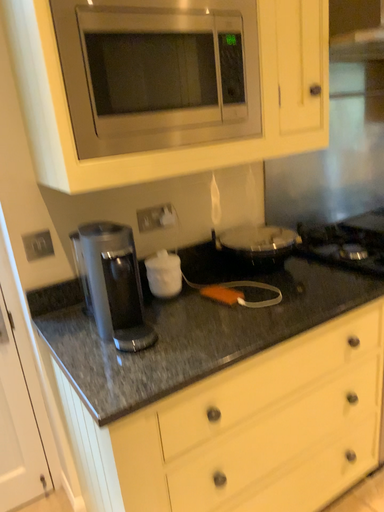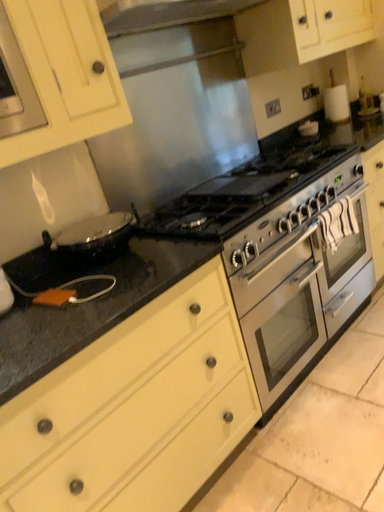
Question: Which way did the camera rotate in the video?

Choices:
 (A) rotated left
 (B) rotated right

Answer: (B)